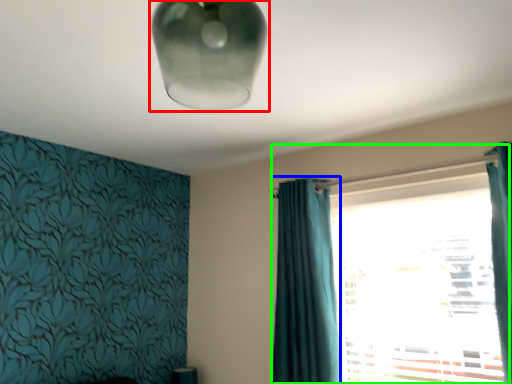
Question: Based on their relative distances, which object is farther from lamp (highlighted by a red box)? Choose from curtain (highlighted by a blue box) and window (highlighted by a green box).

Choices:
 (A) curtain
 (B) window

Answer: (B)